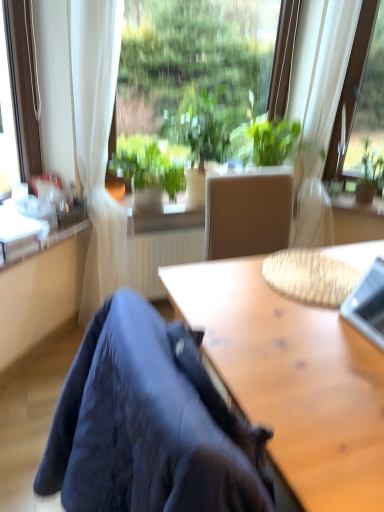
You are a GUI agent. You are given a task and a screenshot of the screen. Output one action in this format:
    pyautogui.click(x=<x>, y=<y>)
    Task: Click on the silver metallic laptop at upper right
    The height and width of the screenshot is (512, 384).
    Given the screenshot: What is the action you would take?
    pyautogui.click(x=368, y=304)

The height and width of the screenshot is (512, 384). What do you see at coordinates (368, 304) in the screenshot?
I see `silver metallic laptop at upper right` at bounding box center [368, 304].

Image resolution: width=384 pixels, height=512 pixels. What do you see at coordinates (196, 71) in the screenshot?
I see `transparent glass window at upper center, the 1th window in the left-to-right sequence` at bounding box center [196, 71].

Locate an element on the screen. This screenshot has height=512, width=384. wooden desk at lower right is located at coordinates (292, 380).

The image size is (384, 512). Describe the element at coordinates (352, 79) in the screenshot. I see `transparent glass window at upper right, placed as the 1th window when sorted from right to left` at that location.

Looking at this image, in order to face white sheer curtain at upper center, should I rotate leftwards or rightwards?

A 16.704 degree turn to the right will do.

Find the location of a particular element. This screenshot has height=512, width=384. green leafy plant at upper right, marked as the first houseplant in a right-to-left arrangement is located at coordinates (370, 175).

Which houseplant is the 1st one when counting from the left side of the wooden desk at lower right? Please provide its 2D coordinates.

[(200, 134)]

Is green leafy plant at center, which appears as the 2th houseplant when viewed from the right, not near wooden desk at lower right?

green leafy plant at center, which appears as the 2th houseplant when viewed from the right, is positioned a significant distance from wooden desk at lower right.

Does point (208, 154) lie behind point (313, 429)?

That is True.

Could you tell me if green leafy plant at center, which is the second houseplant in left-to-right order, is turned towards wooden desk at lower right?

Yes, green leafy plant at center, which is the second houseplant in left-to-right order, is facing wooden desk at lower right.

Is green leafy plant at upper right, marked as the first houseplant in a right-to-left arrangement, touching transparent glass window at upper right, marked as the 2th window in a left-to-right arrangement?

green leafy plant at upper right, marked as the first houseplant in a right-to-left arrangement, and transparent glass window at upper right, marked as the 2th window in a left-to-right arrangement, are not in contact.

Is green leafy plant at upper right, placed as the 3th houseplant when sorted from left to right, turned away from transparent glass window at upper right, marked as the 2th window in a left-to-right arrangement?

green leafy plant at upper right, placed as the 3th houseplant when sorted from left to right, does not have its back to transparent glass window at upper right, marked as the 2th window in a left-to-right arrangement.

How many degrees apart are the facing directions of green leafy plant at upper right, placed as the 3th houseplant when sorted from left to right, and transparent glass window at upper right, placed as the 1th window when sorted from right to left?

green leafy plant at upper right, placed as the 3th houseplant when sorted from left to right, and transparent glass window at upper right, placed as the 1th window when sorted from right to left, are facing 0.00133 degrees away from each other.

From the image's perspective, is green leafy plant at upper right, marked as the first houseplant in a right-to-left arrangement, above transparent glass window at upper right, marked as the 2th window in a left-to-right arrangement?

No, from the image's perspective, green leafy plant at upper right, marked as the first houseplant in a right-to-left arrangement, is not on top of transparent glass window at upper right, marked as the 2th window in a left-to-right arrangement.

Does white sheer curtain at upper center have a larger size compared to transparent glass window at upper center, the 1th window in the left-to-right sequence?

Indeed, white sheer curtain at upper center has a larger size compared to transparent glass window at upper center, the 1th window in the left-to-right sequence.

Can you confirm if white sheer curtain at upper center is thinner than transparent glass window at upper center, the 1th window in the left-to-right sequence?

No.

I want to click on curtain below the transparent glass window at upper center, placed as the second window when sorted from right to left (from the image's perspective), so click(x=329, y=68).

Could transparent glass window at upper right, placed as the 1th window when sorted from right to left, be considered to be inside green leafy plant at center, marked as the 3th houseplant in a right-to-left arrangement?

That's incorrect, transparent glass window at upper right, placed as the 1th window when sorted from right to left, is not inside green leafy plant at center, marked as the 3th houseplant in a right-to-left arrangement.

How different are the orientations of green leafy plant at center, marked as the 3th houseplant in a right-to-left arrangement, and transparent glass window at upper right, placed as the 1th window when sorted from right to left, in degrees?

green leafy plant at center, marked as the 3th houseplant in a right-to-left arrangement, and transparent glass window at upper right, placed as the 1th window when sorted from right to left, are facing 44.6 degrees away from each other.

Is green leafy plant at center, positioned as the 1th houseplant in left-to-right order, facing away from transparent glass window at upper right, marked as the 2th window in a left-to-right arrangement?

No.

From the image's perspective, relative to transparent glass window at upper right, placed as the 1th window when sorted from right to left, is green leafy plant at center, marked as the 3th houseplant in a right-to-left arrangement, above or below?

green leafy plant at center, marked as the 3th houseplant in a right-to-left arrangement, is below transparent glass window at upper right, placed as the 1th window when sorted from right to left.

From a real-world perspective, relative to transparent glass window at upper center, placed as the second window when sorted from right to left, is green leafy plant at center, which appears as the 2th houseplant when viewed from the right, vertically above or below?

In terms of real-world spatial position, green leafy plant at center, which appears as the 2th houseplant when viewed from the right, is below transparent glass window at upper center, placed as the second window when sorted from right to left.

There is a green leafy plant at center, which appears as the 2th houseplant when viewed from the right. At what (x,y) coordinates should I click in order to perform the action: click on the 1st window above it (from a real-world perspective). Please return your answer as a coordinate pair (x, y). Image resolution: width=384 pixels, height=512 pixels. Looking at the image, I should click on (196, 71).

Looking at this image, is green leafy plant at center, which appears as the 2th houseplant when viewed from the right, facing towards transparent glass window at upper center, the 1th window in the left-to-right sequence?

No.

At what (x,y) coordinates should I click in order to perform the action: click on houseplant above the silver metallic laptop at upper right (from a real-world perspective). Please return your answer as a coordinate pair (x, y). Looking at the image, I should click on (200, 134).

Does green leafy plant at center, which appears as the 2th houseplant when viewed from the right, turn towards silver metallic laptop at upper right?

Yes, green leafy plant at center, which appears as the 2th houseplant when viewed from the right, is facing silver metallic laptop at upper right.

Is green leafy plant at center, which is the second houseplant in left-to-right order, shorter than silver metallic laptop at upper right?

No, green leafy plant at center, which is the second houseplant in left-to-right order, is not shorter than silver metallic laptop at upper right.

Is green leafy plant at center, which appears as the 2th houseplant when viewed from the right, next to silver metallic laptop at upper right?

green leafy plant at center, which appears as the 2th houseplant when viewed from the right, is not next to silver metallic laptop at upper right, and they're not touching.

Is silver metallic laptop at upper right located within green leafy plant at upper right, marked as the first houseplant in a right-to-left arrangement?

That's incorrect, silver metallic laptop at upper right is not inside green leafy plant at upper right, marked as the first houseplant in a right-to-left arrangement.

Considering the positions of objects green leafy plant at upper right, placed as the 3th houseplant when sorted from left to right, and silver metallic laptop at upper right in the image provided, who is in front, green leafy plant at upper right, placed as the 3th houseplant when sorted from left to right, or silver metallic laptop at upper right?

silver metallic laptop at upper right is more forward.

Does green leafy plant at upper right, placed as the 3th houseplant when sorted from left to right, have a greater width compared to silver metallic laptop at upper right?

Correct, the width of green leafy plant at upper right, placed as the 3th houseplant when sorted from left to right, exceeds that of silver metallic laptop at upper right.

Does green leafy plant at upper right, marked as the first houseplant in a right-to-left arrangement, turn towards silver metallic laptop at upper right?

Yes, green leafy plant at upper right, marked as the first houseplant in a right-to-left arrangement, is aimed at silver metallic laptop at upper right.

The width and height of the screenshot is (384, 512). In order to click on the 3rd houseplant above when counting from the wooden desk at lower right (from the image's perspective) in this screenshot , I will do `click(200, 134)`.

From the green leafy plant at upper right, marked as the first houseplant in a right-to-left arrangement, count 1st windows forward and point to it. Please provide its 2D coordinates.

[(352, 79)]

From the picture: From the image, which object appears to be nearer to transparent glass window at upper right, marked as the 2th window in a left-to-right arrangement, transparent glass window at upper center, the 1th window in the left-to-right sequence, or green leafy plant at center, marked as the 3th houseplant in a right-to-left arrangement?

Answer: transparent glass window at upper center, the 1th window in the left-to-right sequence, is positioned closer to the anchor transparent glass window at upper right, marked as the 2th window in a left-to-right arrangement.

Based on the photo, when comparing their distances from green leafy plant at upper right, marked as the first houseplant in a right-to-left arrangement, does wooden desk at lower right or transparent glass window at upper right, marked as the 2th window in a left-to-right arrangement, seem closer?

Based on the image, transparent glass window at upper right, marked as the 2th window in a left-to-right arrangement, appears to be nearer to green leafy plant at upper right, marked as the first houseplant in a right-to-left arrangement.

Considering their positions, is green leafy plant at center, positioned as the 1th houseplant in left-to-right order, positioned closer to silver metallic laptop at upper right than transparent glass window at upper right, marked as the 2th window in a left-to-right arrangement?

The object closer to silver metallic laptop at upper right is green leafy plant at center, positioned as the 1th houseplant in left-to-right order.

Based on the photo, looking at the image, which one is located further to transparent glass window at upper right, placed as the 1th window when sorted from right to left, wooden desk at lower right or silver metallic laptop at upper right?

Among the two, wooden desk at lower right is located further to transparent glass window at upper right, placed as the 1th window when sorted from right to left.

From the image, which object appears to be farther from white sheer curtain at upper center, transparent glass window at upper center, the 1th window in the left-to-right sequence, or silver metallic laptop at upper right?

The object further to white sheer curtain at upper center is silver metallic laptop at upper right.

Looking at the image, which one is located further to silver metallic laptop at upper right, green leafy plant at upper right, marked as the first houseplant in a right-to-left arrangement, or transparent glass window at upper center, the 1th window in the left-to-right sequence?

transparent glass window at upper center, the 1th window in the left-to-right sequence, lies further to silver metallic laptop at upper right than the other object.

Considering their positions, is white sheer curtain at upper center positioned closer to wooden desk at lower right than green leafy plant at upper right, marked as the first houseplant in a right-to-left arrangement?

Based on the image, white sheer curtain at upper center appears to be nearer to wooden desk at lower right.

Based on their spatial positions, is silver metallic laptop at upper right or green leafy plant at center, which appears as the 2th houseplant when viewed from the right, closer to green leafy plant at upper right, placed as the 3th houseplant when sorted from left to right?

The object closer to green leafy plant at upper right, placed as the 3th houseplant when sorted from left to right, is green leafy plant at center, which appears as the 2th houseplant when viewed from the right.

Where is `houseplant situated between green leafy plant at center, marked as the 3th houseplant in a right-to-left arrangement, and transparent glass window at upper right, placed as the 1th window when sorted from right to left, from left to right`? The width and height of the screenshot is (384, 512). houseplant situated between green leafy plant at center, marked as the 3th houseplant in a right-to-left arrangement, and transparent glass window at upper right, placed as the 1th window when sorted from right to left, from left to right is located at coordinates (200, 134).

The width and height of the screenshot is (384, 512). I want to click on houseplant situated between green leafy plant at center, marked as the 3th houseplant in a right-to-left arrangement, and white sheer curtain at upper center from left to right, so click(200, 134).

Locate an element on the screen. Image resolution: width=384 pixels, height=512 pixels. houseplant between silver metallic laptop at upper right and green leafy plant at center, which appears as the 2th houseplant when viewed from the right, along the z-axis is located at coordinates (150, 167).

In order to click on houseplant between green leafy plant at center, marked as the 3th houseplant in a right-to-left arrangement, and green leafy plant at upper right, placed as the 3th houseplant when sorted from left to right, in the horizontal direction in this screenshot , I will do `click(200, 134)`.